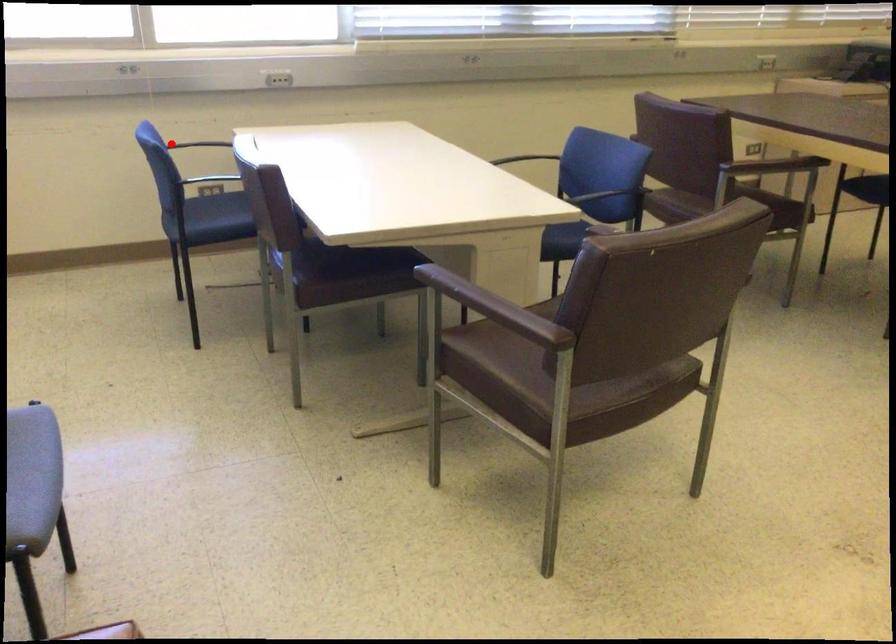
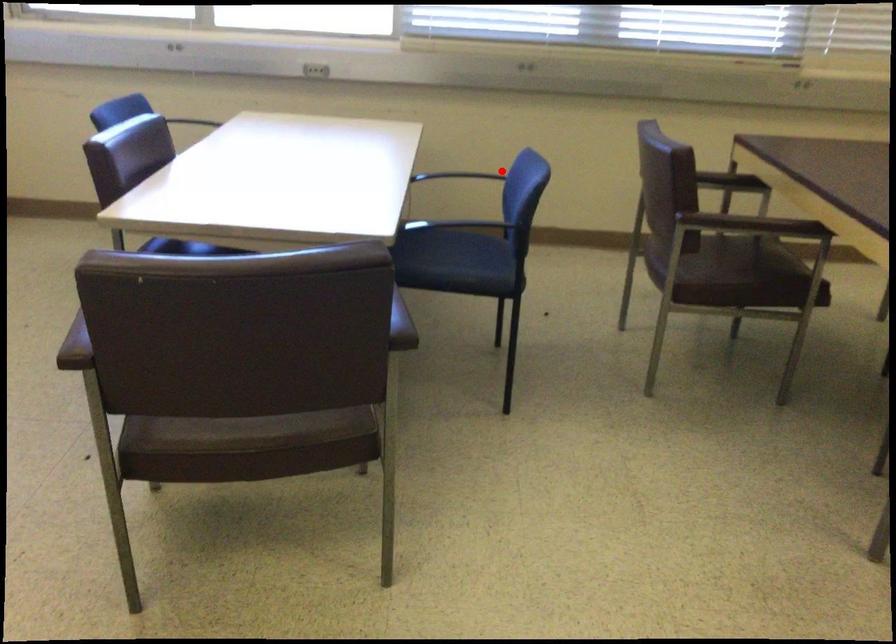
I am providing you with two images of the same scene from different viewpoints. A red point is marked on the first image and another point is marked on the second image. Are the points marked in image1 and image2 representing the same 3D position?

No